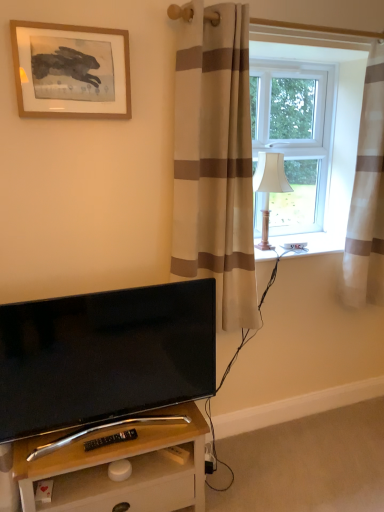
Find the location of a particular element. vacant region to the right of black plastic remote control at lower center is located at coordinates (149, 438).